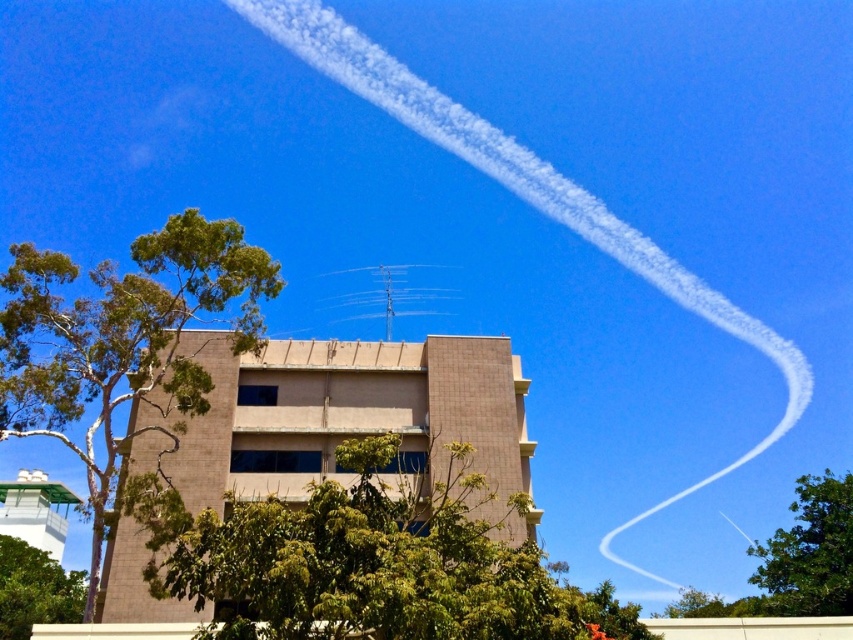
Question: Can you confirm if green leafy tree at left is bigger than green leafy tree at right?

Choices:
 (A) yes
 (B) no

Answer: (B)

Question: Which object is farther from the camera taking this photo?

Choices:
 (A) green leafy tree at left
 (B) green leafy tree at right
 (C) green leafy tree at center

Answer: (B)

Question: Which point is farther to the camera?

Choices:
 (A) green leafy tree at center
 (B) green leafy tree at left
 (C) green leafy tree at lower left

Answer: (C)

Question: Does green leafy tree at right have a larger size compared to green leafy tree at lower left?

Choices:
 (A) yes
 (B) no

Answer: (A)

Question: Is green leafy tree at right further to camera compared to green leafy tree at lower left?

Choices:
 (A) no
 (B) yes

Answer: (A)

Question: Which of the following is the farthest from the observer?

Choices:
 (A) (206, 374)
 (B) (248, 557)
 (C) (44, 600)
 (D) (851, 513)

Answer: (C)